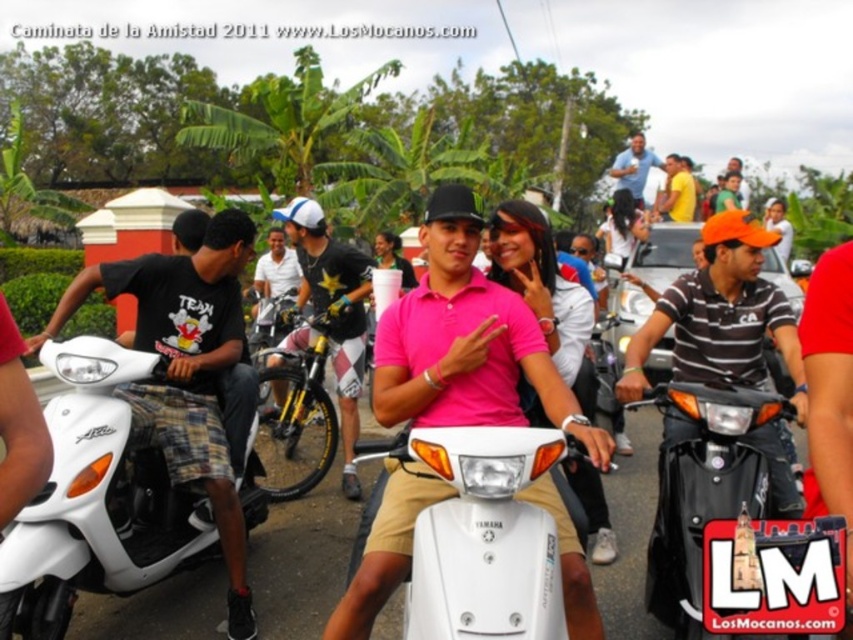
Is white matte scooter at left to the right of black glossy scooter at center from the viewer's perspective?

Incorrect, white matte scooter at left is not on the right side of black glossy scooter at center.

Between white matte scooter at left and black glossy scooter at center, which one is positioned higher?

white matte scooter at left

The height and width of the screenshot is (640, 853). Find the location of `white matte scooter at left`. white matte scooter at left is located at coordinates (94, 499).

Is point (578, 572) more distant than point (805, 410)?

That is False.

This screenshot has height=640, width=853. I want to click on pink matte polo shirt at center, so click(466, 340).

Which is behind, point (302, 221) or point (693, 208)?

Positioned behind is point (693, 208).

Does yellow metallic bicycle at center have a smaller size compared to yellow shirt at upper right?

Indeed, yellow metallic bicycle at center has a smaller size compared to yellow shirt at upper right.

Is point (300, 253) positioned behind point (671, 170)?

No, (300, 253) is in front of (671, 170).

Identify the location of yellow metallic bicycle at center. Image resolution: width=853 pixels, height=640 pixels. (334, 310).